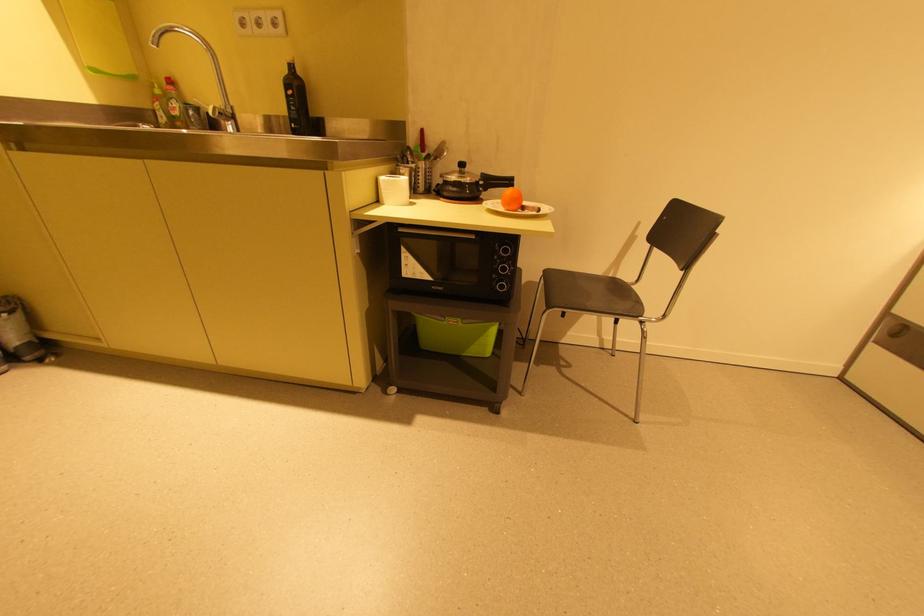
The height and width of the screenshot is (616, 924). I want to click on chair sitting surface, so click(x=590, y=293).